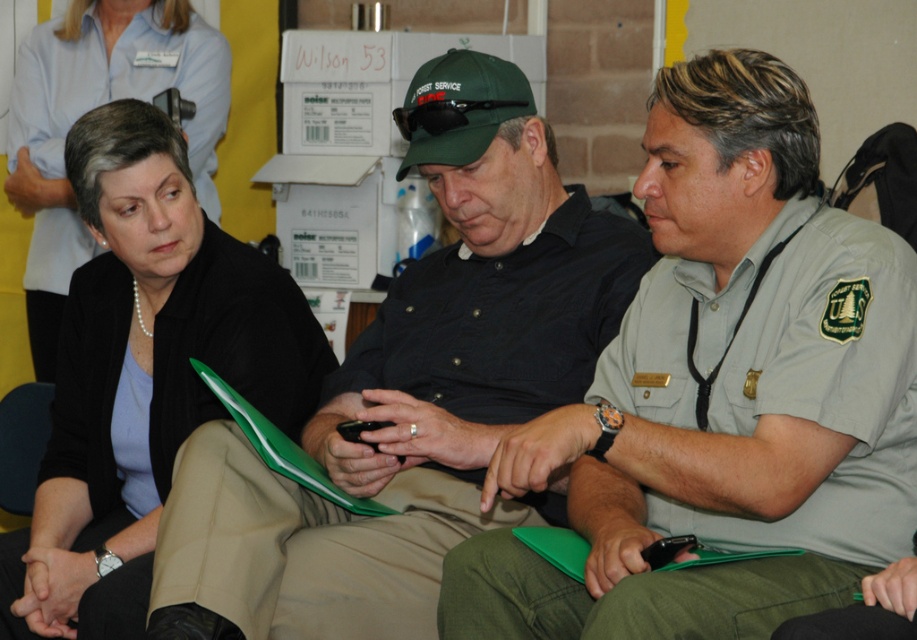
Which is above, green uniform shirt at center or pearl necklace at upper left?

pearl necklace at upper left is higher up.

Can you confirm if green uniform shirt at center is positioned to the left of pearl necklace at upper left?

Incorrect, green uniform shirt at center is not on the left side of pearl necklace at upper left.

Is point (595, 417) positioned behind point (146, 333)?

No, (595, 417) is closer to viewer.

The width and height of the screenshot is (917, 640). In order to click on green uniform shirt at center in this screenshot , I will do `click(722, 392)`.

Is pearl necklace at upper left bigger than pearl necklace at left?

Yes, pearl necklace at upper left is bigger than pearl necklace at left.

Looking at this image, can you confirm if pearl necklace at upper left is positioned to the right of pearl necklace at left?

Yes, pearl necklace at upper left is to the right of pearl necklace at left.

Which is behind, point (32, 508) or point (159, 58)?

Point (159, 58)

At what (x,y) coordinates should I click in order to perform the action: click on pearl necklace at upper left. Please return your answer as a coordinate pair (x, y). Looking at the image, I should click on (142, 374).

Which is above, matte black shirt at center or pearl necklace at upper left?

pearl necklace at upper left

Who is more distant from viewer, (396, 385) or (118, 161)?

The point (118, 161) is more distant.

Find the location of a particular element. This screenshot has width=917, height=640. matte black shirt at center is located at coordinates (412, 392).

Locate an element on the screen. The image size is (917, 640). matte black shirt at center is located at coordinates (412, 392).